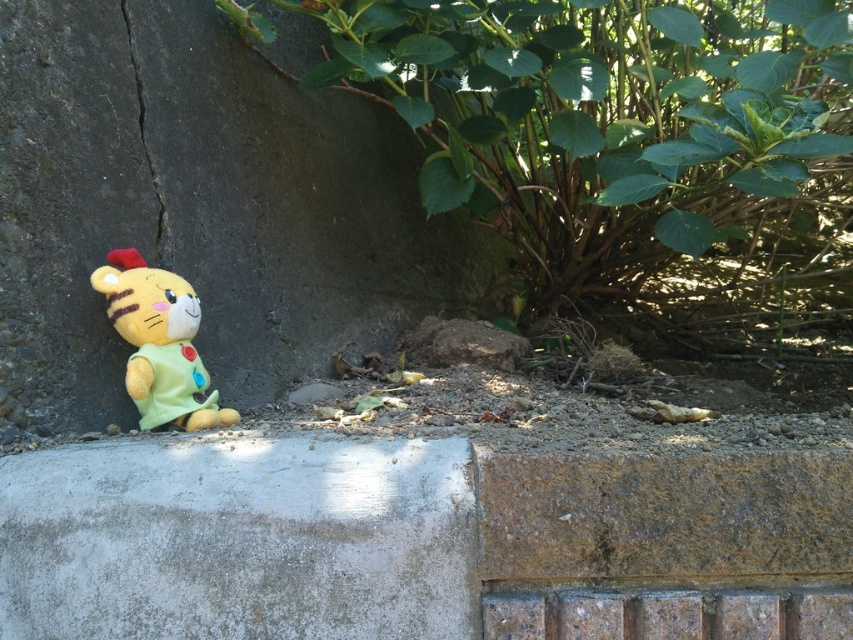
You are standing in the scene and want to place a small flag exactly at the center of the scene. The smooth concrete wall at lower left is located at coordinates point 0.325, 0.236. Where should you place the flag to ensure it is centered?

The flag should be placed at the center coordinates of the scene, which would be different from the smooth concrete wall at lower left located at point (200, 208). However, without specific scene dimensions, the exact coordinates cannot be calculated.

You are standing at the center of the image and want to move towards the green leafy bush at center. Which direction should you go?

The green leafy bush at center is already at the center of the image, so you are already facing it.

You are trying to place a small potted plant between the smooth concrete wall at lower left and the soft plush cat at lower left. Can you fit the plant there?

The smooth concrete wall at lower left is bigger than the soft plush cat at lower left, so there is enough space between them to fit a small potted plant.